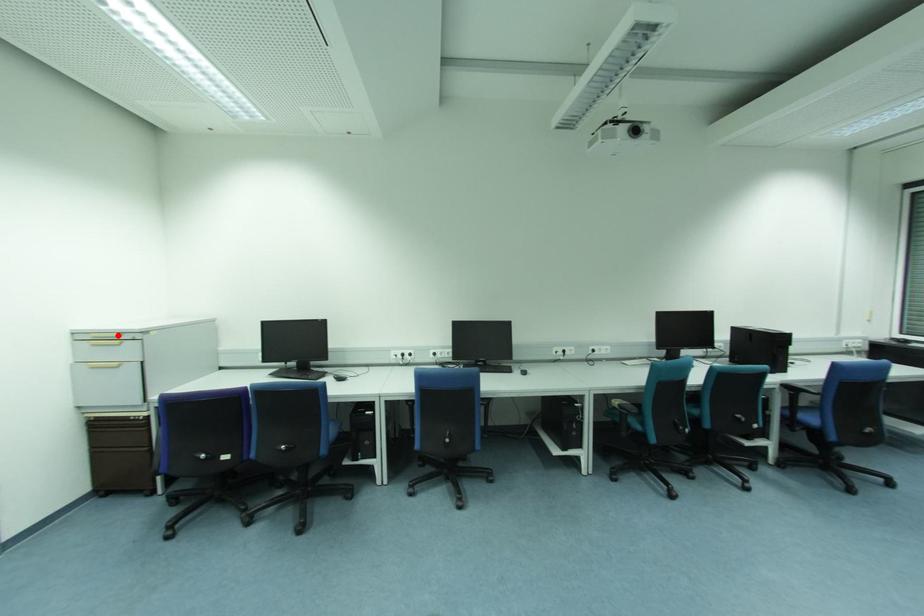
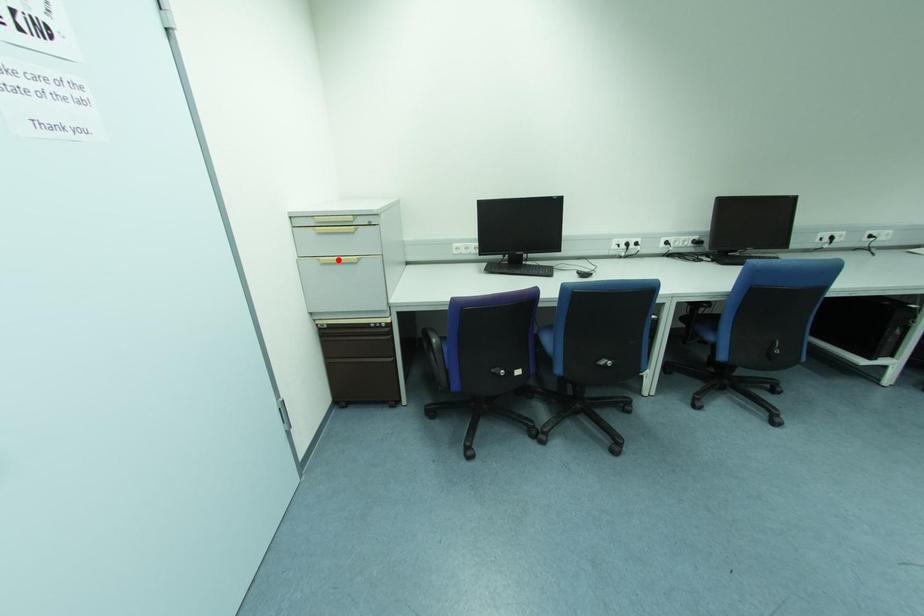
I am providing you with two images of the same scene from different viewpoints. A red point is marked on the first image and another point is marked on the second image. Is the marked point in image1 the same physical position as the marked point in image2?

No